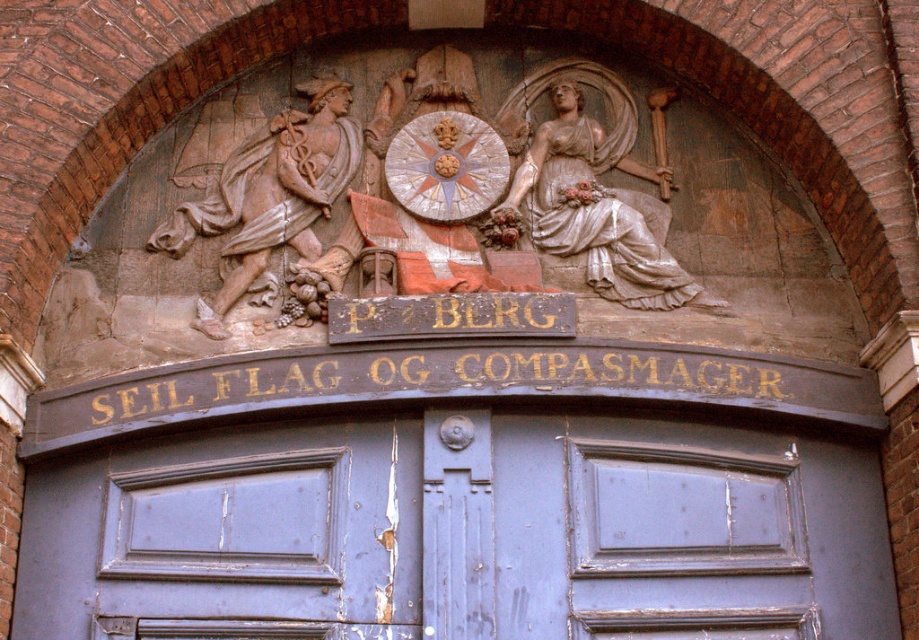
Can you confirm if peeling blue door at center is smaller than white marble statue at upper right?

Incorrect, peeling blue door at center is not smaller in size than white marble statue at upper right.

Is peeling blue door at center shorter than white marble statue at upper right?

Yes, peeling blue door at center is shorter than white marble statue at upper right.

Does point (59, 467) lie in front of point (547, 156)?

Yes, it is.

The height and width of the screenshot is (640, 919). What are the coordinates of `peeling blue door at center` in the screenshot? It's located at (461, 531).

Does blue painted wood door at center have a lesser height compared to white marble statue at upper right?

Correct, blue painted wood door at center is not as tall as white marble statue at upper right.

Between blue painted wood door at center and white marble statue at upper right, which one appears on the left side from the viewer's perspective?

blue painted wood door at center

Identify the location of blue painted wood door at center. This screenshot has height=640, width=919. (227, 534).

Image resolution: width=919 pixels, height=640 pixels. Find the location of `blue painted wood door at center`. blue painted wood door at center is located at coordinates (227, 534).

Between peeling blue door at center and marble statue of man at left, which one has more height?

With more height is marble statue of man at left.

Who is lower down, peeling blue door at center or marble statue of man at left?

Positioned lower is peeling blue door at center.

Locate an element on the screen. The width and height of the screenshot is (919, 640). peeling blue door at center is located at coordinates (461, 531).